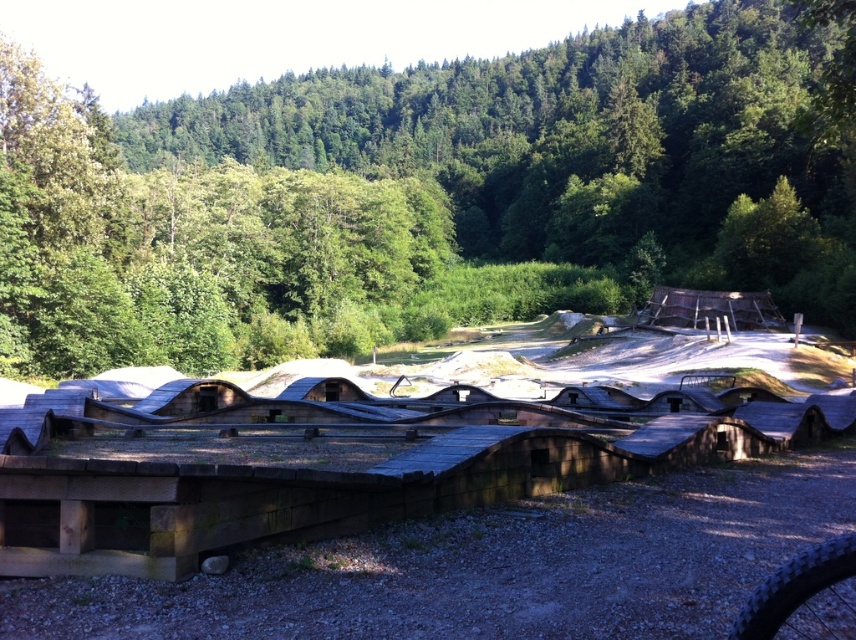
You are standing in the middle of the gravelly area and want to place a new decorative item between the green leafy forest at upper center and the black rubber tire at lower right. Based on their positions, which object is closer to you so you can place the item appropriately?

The green leafy forest at upper center is closer to you than the black rubber tire at lower right, so you should place the item between them near the green leafy forest at upper center.